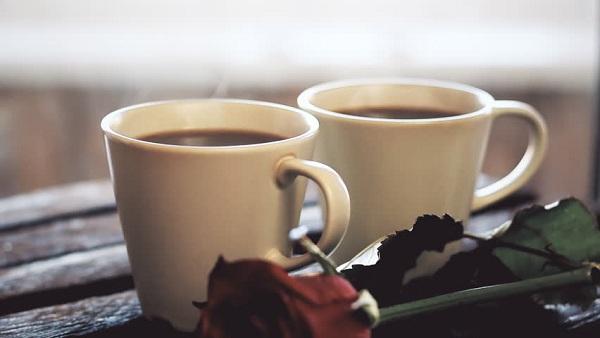
This screenshot has height=338, width=600. Find the location of `handle`. handle is located at coordinates pos(336,215).